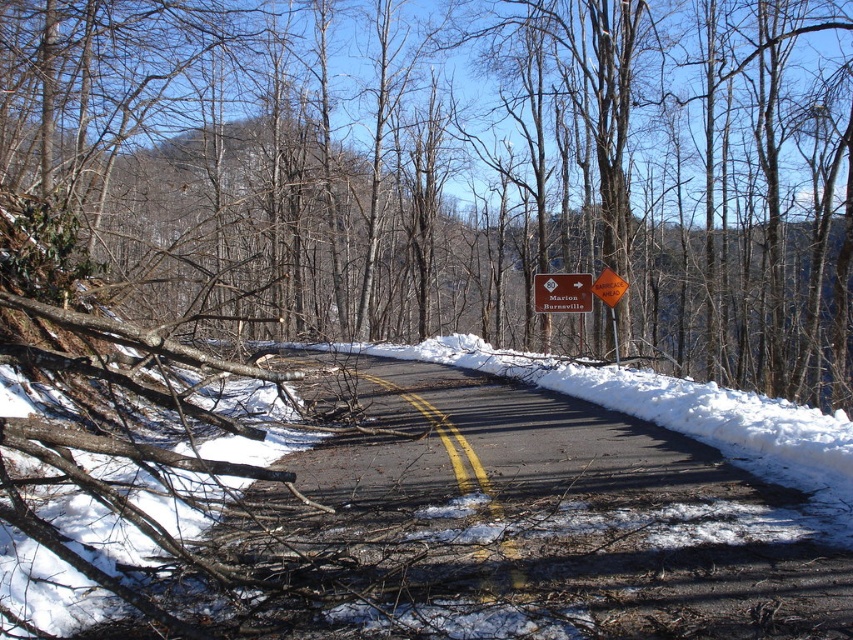
Question: Does brown wood log at lower left have a smaller size compared to brown wooden sign at center?

Choices:
 (A) no
 (B) yes

Answer: (A)

Question: Which point is closer to the camera?

Choices:
 (A) brown wood log at lower left
 (B) orange reflective diamond at center

Answer: (A)

Question: Observing the image, what is the correct spatial positioning of brown wood log at lower left in reference to white powdery snow at lower left?

Choices:
 (A) left
 (B) right

Answer: (B)

Question: Which point is farther to the camera?

Choices:
 (A) brown wood log at lower left
 (B) brown wooden sign at center

Answer: (B)

Question: Does brown wood log at lower left appear under brown wooden sign at center?

Choices:
 (A) yes
 (B) no

Answer: (B)

Question: Which object appears closest to the camera in this image?

Choices:
 (A) white powdery snow at lower left
 (B) brown wooden sign at center
 (C) orange reflective diamond at center
 (D) brown wood log at lower left

Answer: (A)